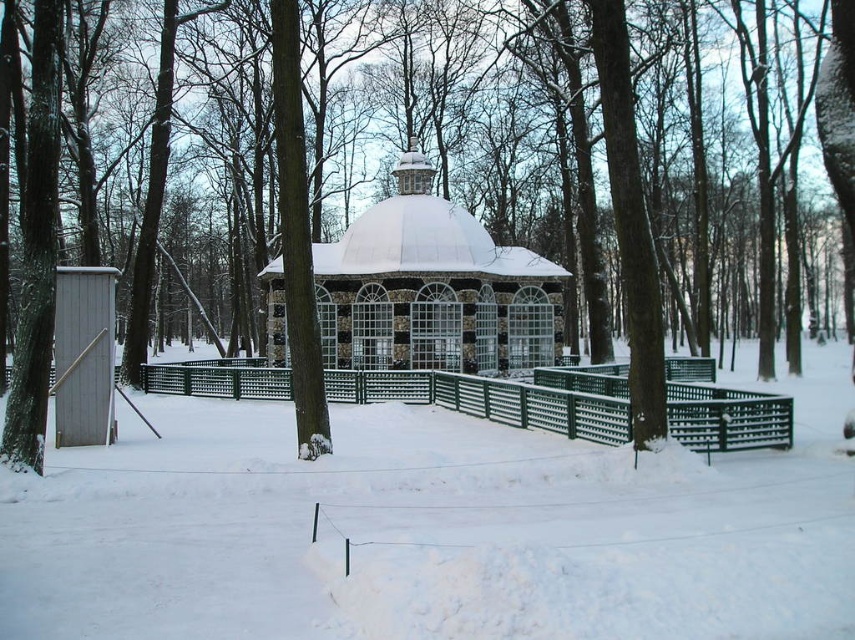
You are planning to place a new bench in the snowy park scene. The bench must be placed between the brown textured tree at center and the green metal fence at center. Considering their sizes, which object should the bench be closer to?

The bench should be placed closer to the green metal fence at center because the brown textured tree at center has a larger size compared to the green metal fence at center, so there is more space near the smaller fence to accommodate the bench.